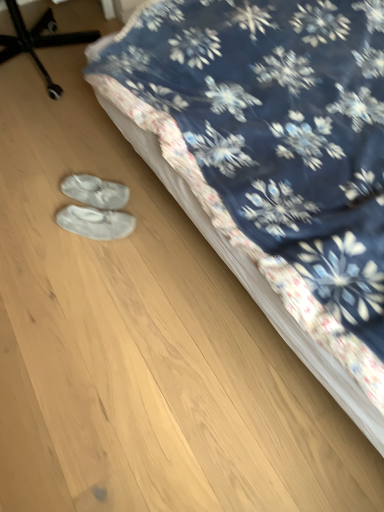
Question: Is white fabric shoe covers at lower left, arranged as the second footwear when ordered from the bottom, behind white suede slippers at lower center, which is the second footwear from top to bottom?

Choices:
 (A) no
 (B) yes

Answer: (B)

Question: Is white fabric shoe covers at lower left, which ranks as the first footwear in top-to-bottom order, to the right of white suede slippers at lower center, which is the second footwear from top to bottom, from the viewer's perspective?

Choices:
 (A) no
 (B) yes

Answer: (A)

Question: Is white suede slippers at lower center, the first footwear from the bottom, a part of white fabric shoe covers at lower left, arranged as the second footwear when ordered from the bottom?

Choices:
 (A) no
 (B) yes

Answer: (A)

Question: Does white fabric shoe covers at lower left, which ranks as the first footwear in top-to-bottom order, have a lesser height compared to white suede slippers at lower center, which is the second footwear from top to bottom?

Choices:
 (A) no
 (B) yes

Answer: (A)

Question: Can you confirm if white fabric shoe covers at lower left, which ranks as the first footwear in top-to-bottom order, is positioned to the left of white suede slippers at lower center, which is the second footwear from top to bottom?

Choices:
 (A) no
 (B) yes

Answer: (B)

Question: Is point (130, 216) positioned closer to the camera than point (304, 117)?

Choices:
 (A) closer
 (B) farther

Answer: (B)

Question: From a real-world perspective, is white suede slippers at lower center, the first footwear from the bottom, above or below floral fabric bed at center?

Choices:
 (A) above
 (B) below

Answer: (B)

Question: Is white suede slippers at lower center, the first footwear from the bottom, wider or thinner than floral fabric bed at center?

Choices:
 (A) thin
 (B) wide

Answer: (A)

Question: Considering the positions of white suede slippers at lower center, the first footwear from the bottom, and floral fabric bed at center in the image, is white suede slippers at lower center, the first footwear from the bottom, taller or shorter than floral fabric bed at center?

Choices:
 (A) tall
 (B) short

Answer: (B)

Question: From a real-world perspective, is floral fabric bed at center above or below white suede slippers at lower center, the first footwear from the bottom?

Choices:
 (A) below
 (B) above

Answer: (B)

Question: Is floral fabric bed at center inside the boundaries of white suede slippers at lower center, the first footwear from the bottom, or outside?

Choices:
 (A) inside
 (B) outside

Answer: (B)

Question: Is floral fabric bed at center taller or shorter than white suede slippers at lower center, the first footwear from the bottom?

Choices:
 (A) short
 (B) tall

Answer: (B)

Question: In terms of width, does floral fabric bed at center look wider or thinner when compared to white suede slippers at lower center, which is the second footwear from top to bottom?

Choices:
 (A) thin
 (B) wide

Answer: (B)

Question: Is point (241, 126) positioned closer to the camera than point (82, 196)?

Choices:
 (A) farther
 (B) closer

Answer: (B)

Question: In the image, is floral fabric bed at center positioned in front of or behind white fabric shoe covers at lower left, arranged as the second footwear when ordered from the bottom?

Choices:
 (A) behind
 (B) front

Answer: (B)